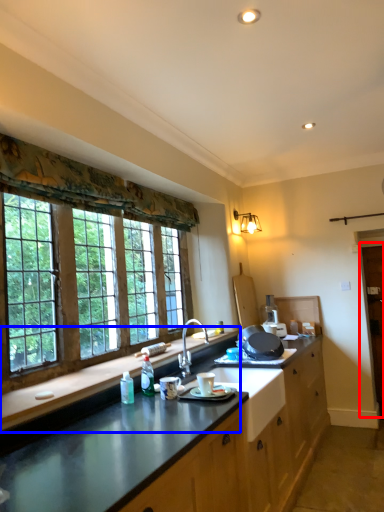
Question: Which object is further to the camera taking this photo, barn door (highlighted by a red box) or countertop (highlighted by a blue box)?

Choices:
 (A) barn door
 (B) countertop

Answer: (A)